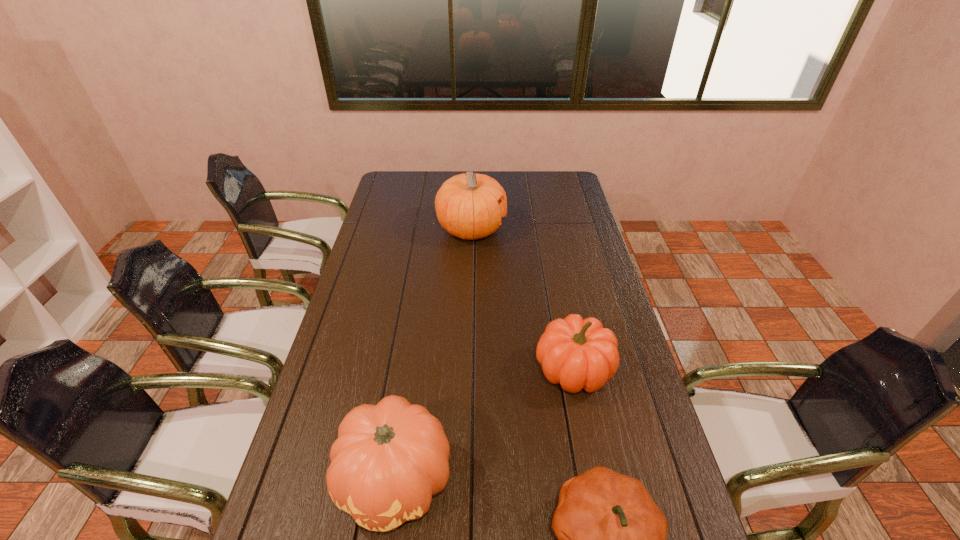
Choose which object is the second nearest neighbor to the second farthest pumpkin. Please provide its 2D coordinates. Your answer should be formatted as a tuple, i.e. [(x, y)], where the tuple contains the x and y coordinates of a point satisfying the conditions above.

[(389, 459)]

Where is `object that stands as the closest to the shortest object`? object that stands as the closest to the shortest object is located at coordinates (389, 459).

Identify the location of pumpkin that can be found as the closest to the shortest object. (389, 459).

Find the location of `pumpkin that stands as the third closest to the third nearest pumpkin`. pumpkin that stands as the third closest to the third nearest pumpkin is located at coordinates [x=467, y=205].